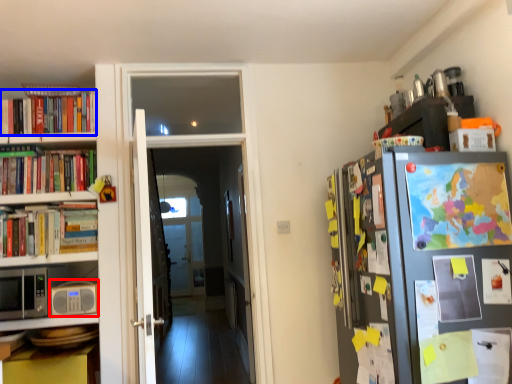
Question: Which of the following is the farthest to the observer, appliance (highlighted by a red box) or book (highlighted by a blue box)?

Choices:
 (A) appliance
 (B) book

Answer: (B)